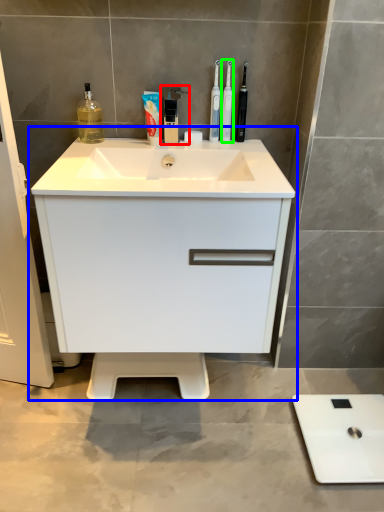
Question: Which is nearer to the faucet (highlighted by a red box)? bathroom cabinet (highlighted by a blue box) or toothbrush (highlighted by a green box).

Choices:
 (A) bathroom cabinet
 (B) toothbrush

Answer: (B)